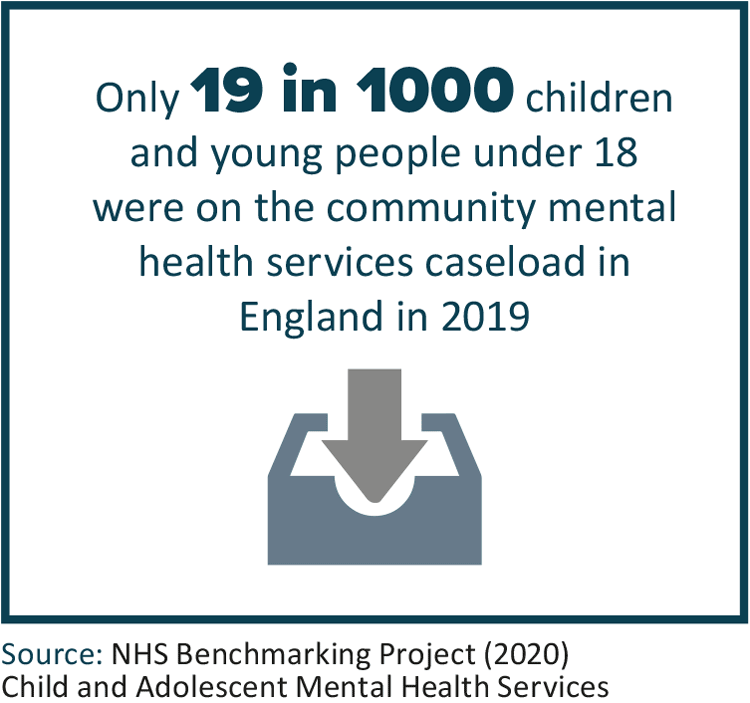
Where is `box`? Image resolution: width=750 pixels, height=703 pixels. box is located at coordinates (454, 528).